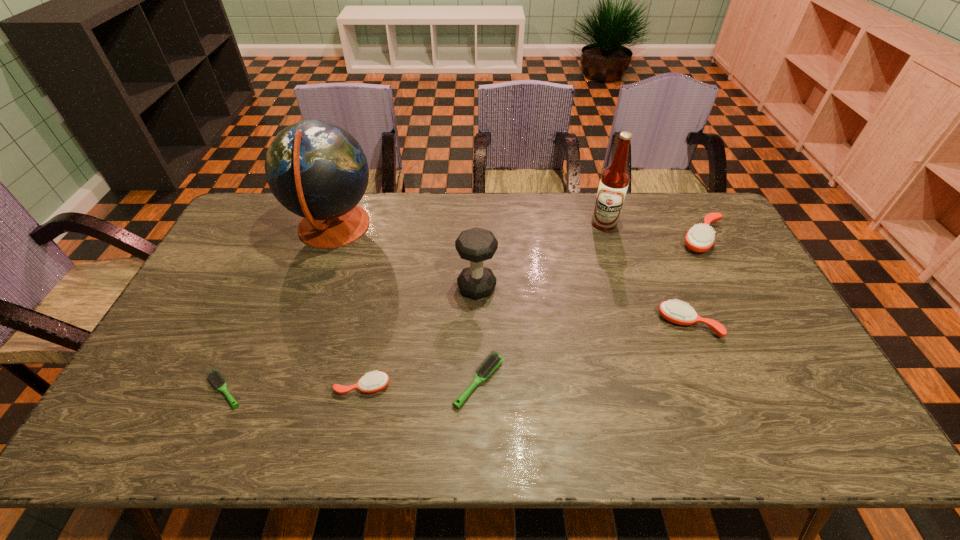
Find the location of a particular element. Image resolution: width=960 pixels, height=540 pixels. vacant area that lies between the leftmost hairbrush and the rightmost hairbrush is located at coordinates (464, 314).

Where is `unoccupied position between the alcohol and the dumbbell`? unoccupied position between the alcohol and the dumbbell is located at coordinates (540, 255).

Find the location of `vacant space that is in between the fourth nearest hairbrush and the globe`. vacant space that is in between the fourth nearest hairbrush and the globe is located at coordinates (511, 275).

The height and width of the screenshot is (540, 960). Identify the location of object identified as the fifth closest to the rightmost object. (372, 382).

Select which object is the sixth closest to the right light hairbrush. Please provide its 2D coordinates. Your answer should be formatted as a tuple, i.e. [(x, y)], where the tuple contains the x and y coordinates of a point satisfying the conditions above.

[(614, 181)]

Identify which hairbrush is the fourth nearest to the globe. Please provide its 2D coordinates. Your answer should be formatted as a tuple, i.e. [(x, y)], where the tuple contains the x and y coordinates of a point satisfying the conditions above.

[(676, 312)]

The height and width of the screenshot is (540, 960). Identify the location of hairbrush that is the second closest one to the gray dumbbell. (372, 382).

Point out which orange hairbrush is positioned as the nearest to the second shortest hairbrush. Please provide its 2D coordinates. Your answer should be formatted as a tuple, i.e. [(x, y)], where the tuple contains the x and y coordinates of a point satisfying the conditions above.

[(372, 382)]

Where is `the second closest orange hairbrush to the nearest orange hairbrush`? This screenshot has width=960, height=540. the second closest orange hairbrush to the nearest orange hairbrush is located at coordinates (700, 238).

This screenshot has height=540, width=960. Identify the location of free space that satisfies the following two spatial constraints: 1. with the Americas facing the viewer on the globe; 2. on the left side of the biggest orange hairbrush. (329, 239).